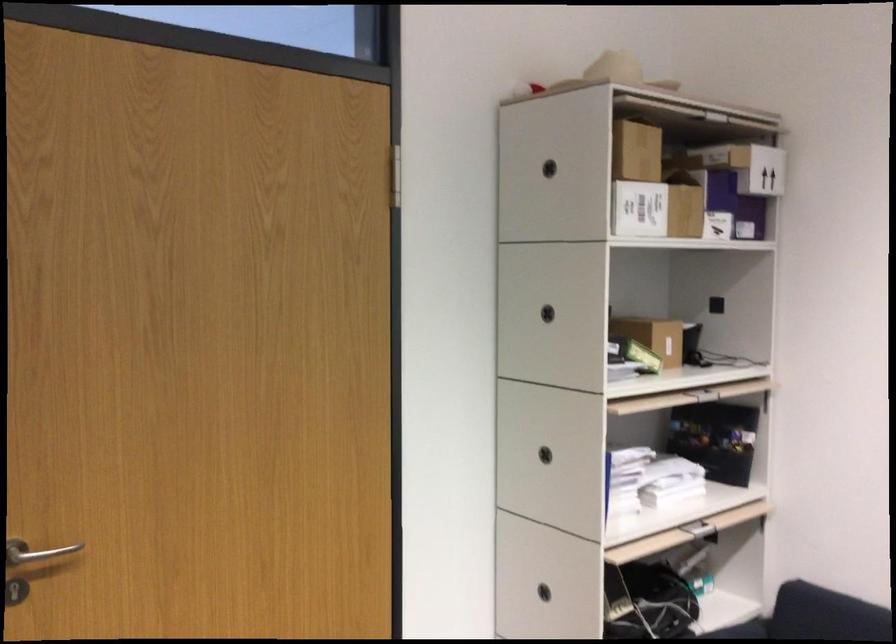
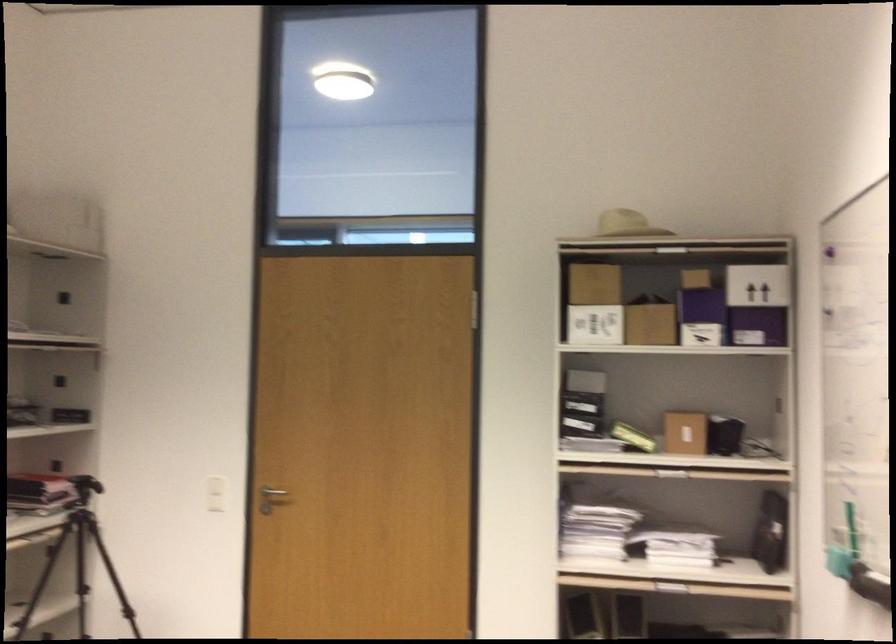
The point at (699,204) is marked in the first image. Where is the corresponding point in the second image?

(702, 317)